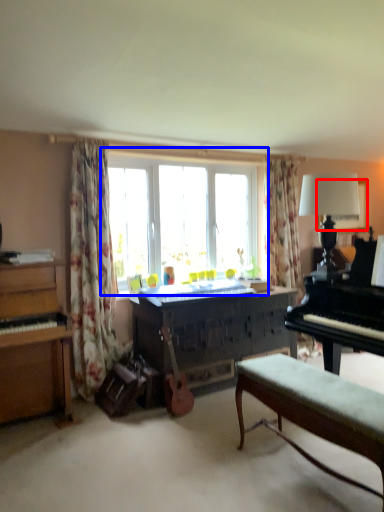
Question: Among these objects, which one is nearest to the camera, picture frame (highlighted by a red box) or window (highlighted by a blue box)?

Choices:
 (A) picture frame
 (B) window

Answer: (B)